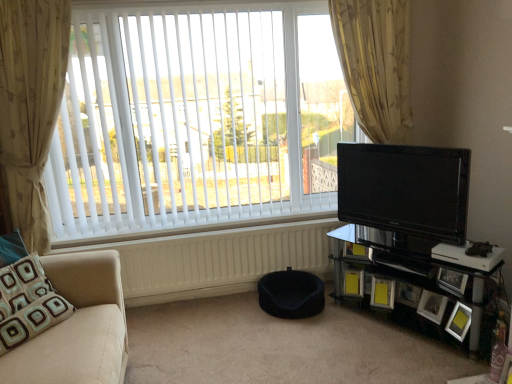
Identify the location of free space in front of wooden picture frame at lower right, the 3th picture frame viewed from the right. The width and height of the screenshot is (512, 384). (436, 332).